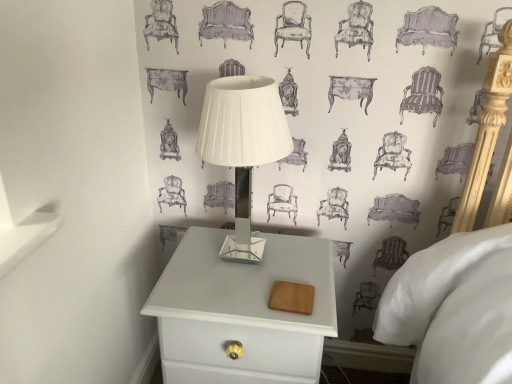
Question: From a real-world perspective, is white matte nightstand at lower center physically below white glossy table lamp at center?

Choices:
 (A) yes
 (B) no

Answer: (A)

Question: Is white matte nightstand at lower center surrounding white glossy table lamp at center?

Choices:
 (A) yes
 (B) no

Answer: (B)

Question: Can you confirm if white matte nightstand at lower center is wider than white glossy table lamp at center?

Choices:
 (A) yes
 (B) no

Answer: (A)

Question: Considering the relative sizes of white matte nightstand at lower center and white glossy table lamp at center in the image provided, is white matte nightstand at lower center smaller than white glossy table lamp at center?

Choices:
 (A) yes
 (B) no

Answer: (B)

Question: Is the position of white matte nightstand at lower center less distant than that of white glossy table lamp at center?

Choices:
 (A) yes
 (B) no

Answer: (B)

Question: Are white matte nightstand at lower center and white glossy table lamp at center making contact?

Choices:
 (A) yes
 (B) no

Answer: (B)

Question: Is white glossy table lamp at center positioned far away from white matte nightstand at lower center?

Choices:
 (A) yes
 (B) no

Answer: (B)

Question: Considering the relative sizes of white glossy table lamp at center and white matte nightstand at lower center in the image provided, is white glossy table lamp at center shorter than white matte nightstand at lower center?

Choices:
 (A) yes
 (B) no

Answer: (A)

Question: From a real-world perspective, is white glossy table lamp at center over white matte nightstand at lower center?

Choices:
 (A) no
 (B) yes

Answer: (B)

Question: From the image's perspective, is white glossy table lamp at center beneath white matte nightstand at lower center?

Choices:
 (A) no
 (B) yes

Answer: (A)

Question: Considering the relative sizes of white glossy table lamp at center and white matte nightstand at lower center in the image provided, is white glossy table lamp at center thinner than white matte nightstand at lower center?

Choices:
 (A) no
 (B) yes

Answer: (B)

Question: Considering the relative sizes of white glossy table lamp at center and white matte nightstand at lower center in the image provided, is white glossy table lamp at center taller than white matte nightstand at lower center?

Choices:
 (A) no
 (B) yes

Answer: (A)

Question: Is white matte nightstand at lower center in front of or behind white glossy table lamp at center in the image?

Choices:
 (A) front
 (B) behind

Answer: (B)